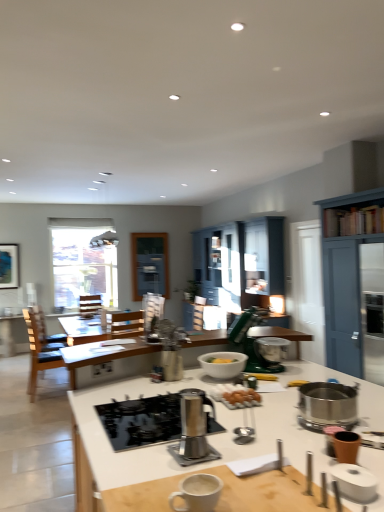
Question: Visually, is brown wooden chair at left positioned to the left or to the right of stainless steel gas stove at center?

Choices:
 (A) right
 (B) left

Answer: (B)

Question: In the image, is brown wooden chair at left positioned in front of or behind stainless steel gas stove at center?

Choices:
 (A) front
 (B) behind

Answer: (B)

Question: Which is nearer to the metallic silver stand mixer at center, the second appliance viewed from the back?

Choices:
 (A) green matte stand mixer at center, placed as the first appliance when sorted from back to front
 (B) white matte bowl at center
 (C) stainless steel gas stove at center
 (D) matte blue cabinet at center, which is the 1th cabinetry in back-to-front order
 (E) brown matte cup at lower right, which ranks as the fourth appliance in back-to-front order

Answer: (B)

Question: Which is farther from the blue painted wood cabinet at right, acting as the first cabinetry starting from the right?

Choices:
 (A) stainless steel gas stove at center
 (B) white paper towel at lower right, the 5th appliance from the back
 (C) clear glass window at upper left
 (D) satin silver coffee maker at center, the 3th appliance viewed from the front
 (E) white glossy countertop at center

Answer: (C)